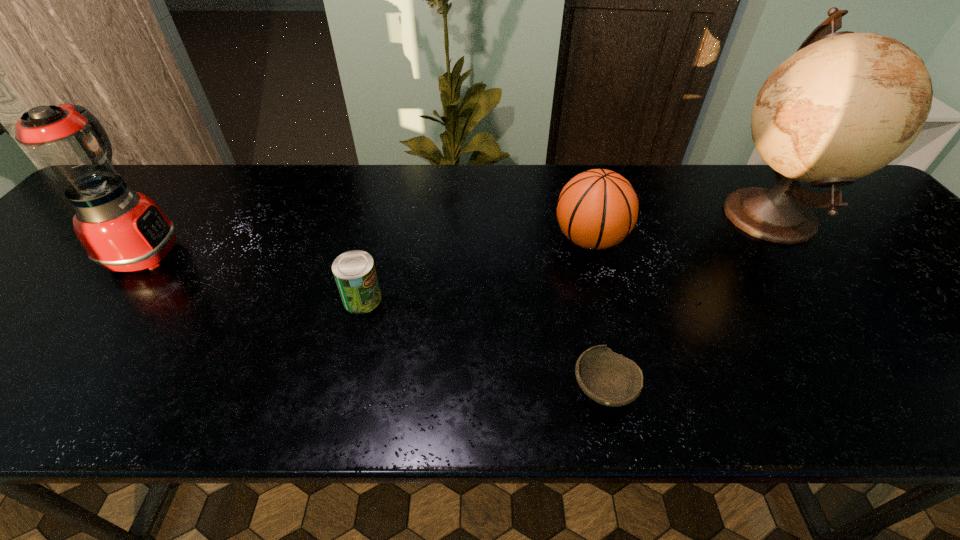
Image resolution: width=960 pixels, height=540 pixels. What are the coordinates of `free space located on the front-facing side of the rightmost object` in the screenshot? It's located at (576, 214).

The width and height of the screenshot is (960, 540). What are the coordinates of `vacant region located on the front-facing side of the rightmost object` in the screenshot? It's located at (584, 214).

Where is `vacant region located on the controls of the food processor`? This screenshot has height=540, width=960. vacant region located on the controls of the food processor is located at coordinates (302, 252).

The height and width of the screenshot is (540, 960). Find the location of `vacant area situated 0.050m on the front of the basketball`. vacant area situated 0.050m on the front of the basketball is located at coordinates (601, 281).

Identify the location of free spot located 0.380m on the right of the second shortest object. The width and height of the screenshot is (960, 540). click(x=553, y=299).

Identify the location of free region located 0.060m on the left of the nearest object. (540, 389).

Where is `object situated at the far edge`? Image resolution: width=960 pixels, height=540 pixels. object situated at the far edge is located at coordinates (845, 105).

The height and width of the screenshot is (540, 960). What are the coordinates of `object present at the near edge` in the screenshot? It's located at (608, 378).

At what (x,y) coordinates should I click in order to perform the action: click on object positioned at the right edge. Please return your answer as a coordinate pair (x, y). This screenshot has width=960, height=540. Looking at the image, I should click on (845, 105).

This screenshot has height=540, width=960. I want to click on object at the far right corner, so click(x=845, y=105).